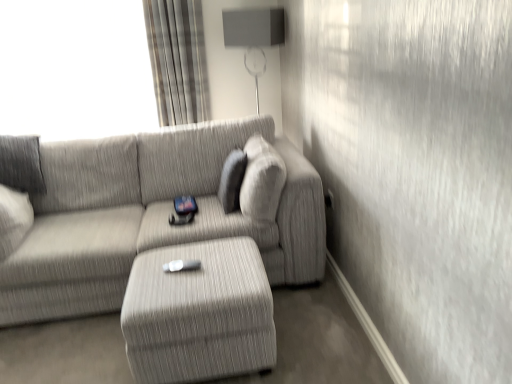
Question: From the image's perspective, is plaid fabric curtain at upper left located above or below textured gray couch at center?

Choices:
 (A) below
 (B) above

Answer: (B)

Question: Is plaid fabric curtain at upper left taller or shorter than textured gray couch at center?

Choices:
 (A) short
 (B) tall

Answer: (B)

Question: Considering the real-world distances, which object is farthest from the textured gray couch at center?

Choices:
 (A) white matte wii controller at center
 (B) textured gray ottoman at center
 (C) plaid fabric curtain at upper left
 (D) matte gray lampshade at upper center

Answer: (D)

Question: Which of these objects is positioned closest to the plaid fabric curtain at upper left?

Choices:
 (A) matte gray lampshade at upper center
 (B) white matte wii controller at center
 (C) textured gray couch at center
 (D) textured gray ottoman at center

Answer: (A)